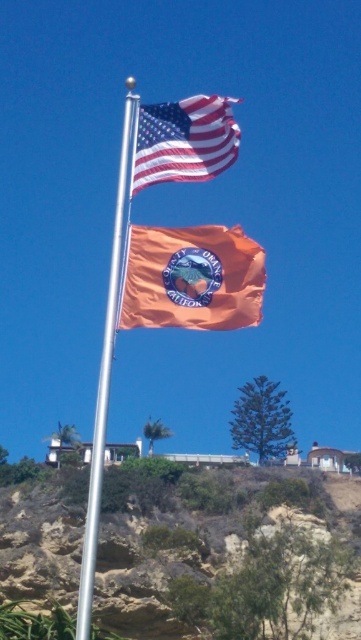
Question: Estimate the real-world distances between objects in this image. Which object is farther from the brown rocky cliff at lower center?

Choices:
 (A) orange matte flag at center
 (B) american flag at upper center
 (C) silver metallic flag pole at center

Answer: (A)

Question: Among these objects, which one is farthest from the camera?

Choices:
 (A) american flag at upper center
 (B) orange matte flag at center

Answer: (A)

Question: Which point is farther from the camera taking this photo?

Choices:
 (A) pyautogui.click(x=318, y=520)
 (B) pyautogui.click(x=193, y=132)
 (C) pyautogui.click(x=222, y=282)
 (D) pyautogui.click(x=88, y=566)

Answer: (A)

Question: Can you confirm if orange matte flag at center is smaller than american flag at upper center?

Choices:
 (A) yes
 (B) no

Answer: (A)

Question: Considering the relative positions of orange matte flag at center and american flag at upper center in the image provided, where is orange matte flag at center located with respect to american flag at upper center?

Choices:
 (A) above
 (B) below

Answer: (B)

Question: Does orange matte flag at center have a lesser width compared to american flag at upper center?

Choices:
 (A) yes
 (B) no

Answer: (A)